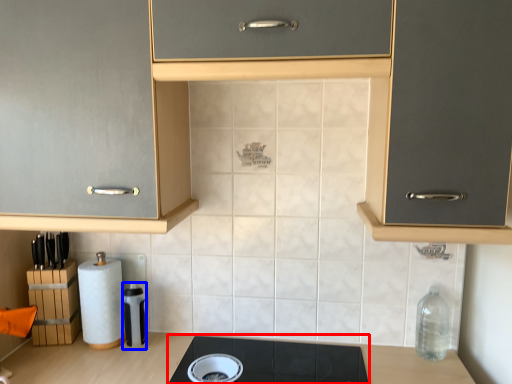
Question: Which object is further to the camera taking this photo, gas stove (highlighted by a red box) or appliance (highlighted by a blue box)?

Choices:
 (A) gas stove
 (B) appliance

Answer: (B)